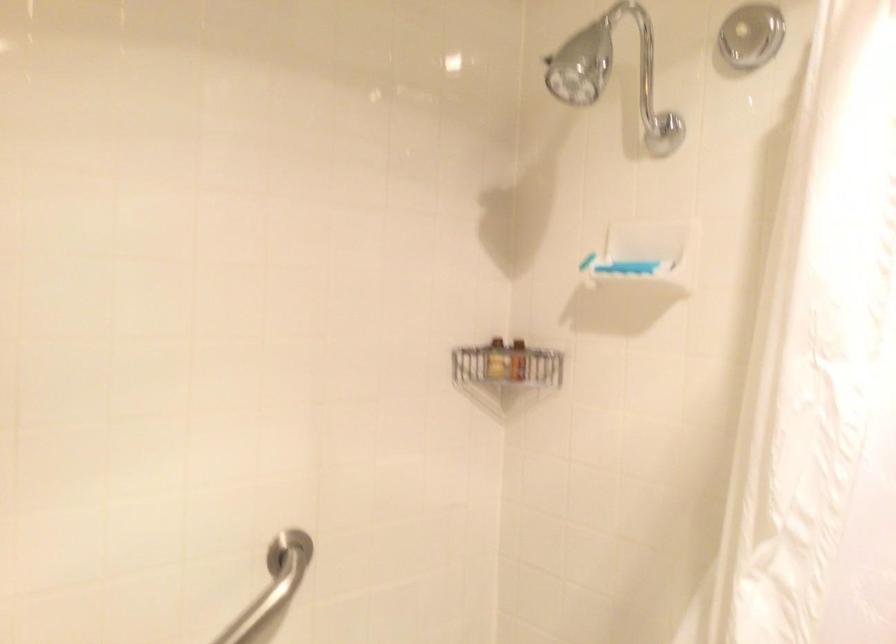
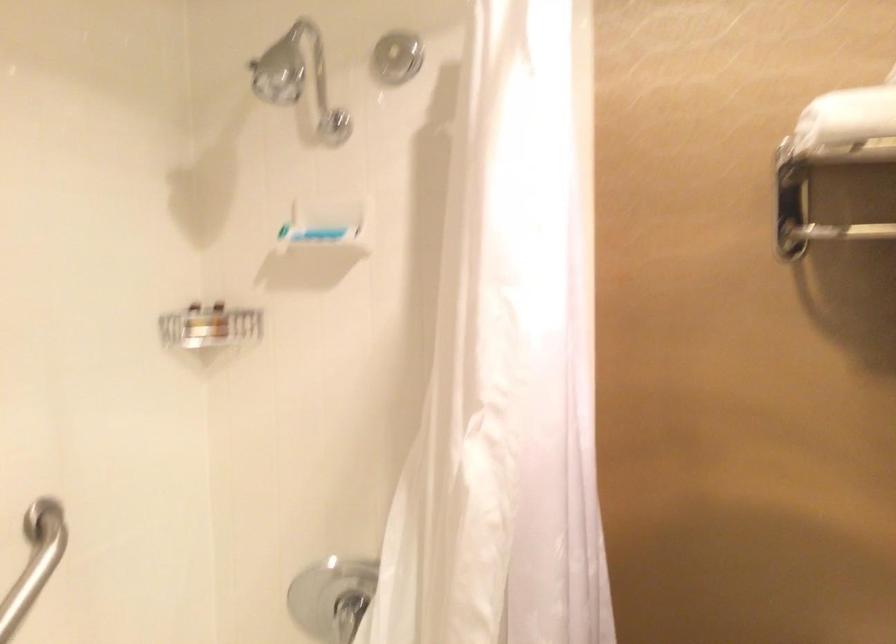
Locate, in the second image, the point that corresponds to (565,71) in the first image.

(279, 73)